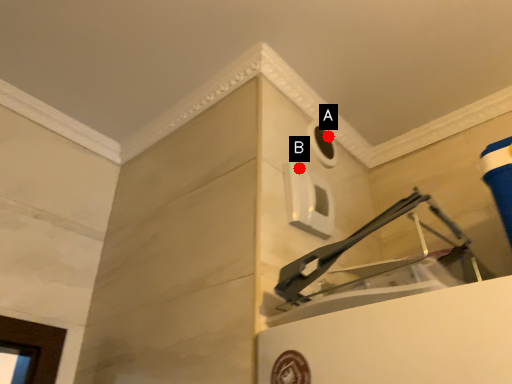
Question: Two points are circled on the image, labeled by A and B beside each circle. Which point is further to the camera?

Choices:
 (A) A is further
 (B) B is further

Answer: (A)